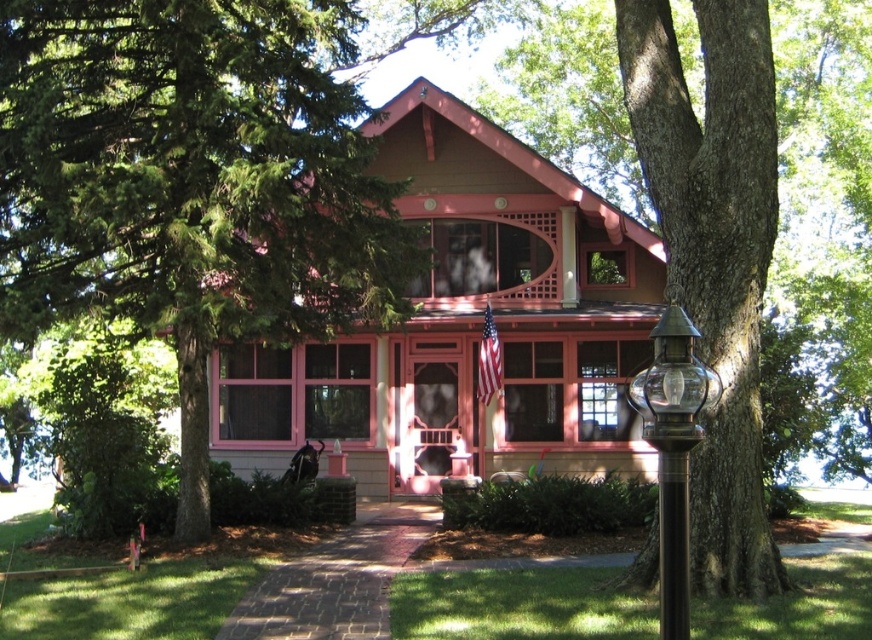
You are standing in front of the house and notice two trees. The green leafy tree at left and the smooth brown tree trunk at right. Which tree has a larger size?

The green leafy tree at left is bigger than the smooth brown tree trunk at right.

You are standing at the front door of the house and see two points marked on the image. The first point is at coordinates point (158, 58) and the second is at point (699, 472). Which point is closer to you?

Point (158, 58) is behind point (699, 472), so the point closer to you is point (699, 472).

You are standing in front of the house and want to plant a new tree. The point marked at coordinates point (714, 253) indicates where the smooth brown tree trunk at right is currently located. If you want to plant a new tree 2 meters to the left of the existing tree, where should you place it?

The new tree should be planted 2 meters to the left of the smooth brown tree trunk at right, which is currently located at point (714, 253).